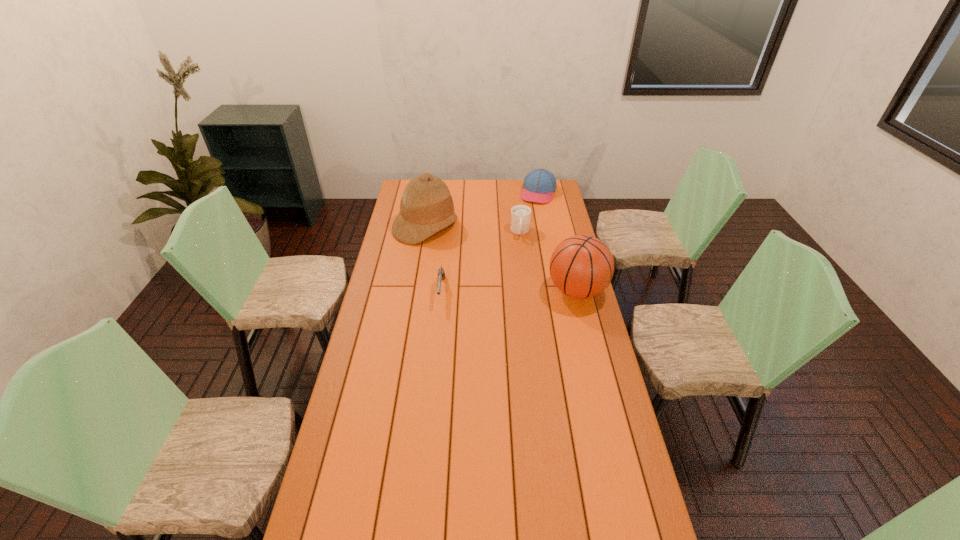
Image resolution: width=960 pixels, height=540 pixels. Identify the location of object located at the far right corner. (539, 185).

Find the location of a particular element. free space at the far edge of the desktop is located at coordinates (492, 181).

What are the coordinates of `free region at the near edge of the desktop` in the screenshot? It's located at (383, 531).

The image size is (960, 540). What are the coordinates of `vacant space at the left edge of the desktop` in the screenshot? It's located at (387, 315).

Identify the location of free space at the right edge of the desktop. (575, 348).

This screenshot has width=960, height=540. In order to click on vacant region between the baseball cap and the basketball in this screenshot , I will do `click(558, 241)`.

This screenshot has height=540, width=960. In order to click on empty location between the basketball and the gun in this screenshot , I will do [x=509, y=291].

Where is `unoccupied area between the baseball cap and the basketball`? Image resolution: width=960 pixels, height=540 pixels. unoccupied area between the baseball cap and the basketball is located at coordinates (558, 241).

At what (x,y) coordinates should I click in order to perform the action: click on free space between the farthest object and the basketball. Please return your answer as a coordinate pair (x, y). The image size is (960, 540). Looking at the image, I should click on click(x=558, y=241).

In order to click on free space between the basketball and the shortest object in this screenshot , I will do `click(509, 291)`.